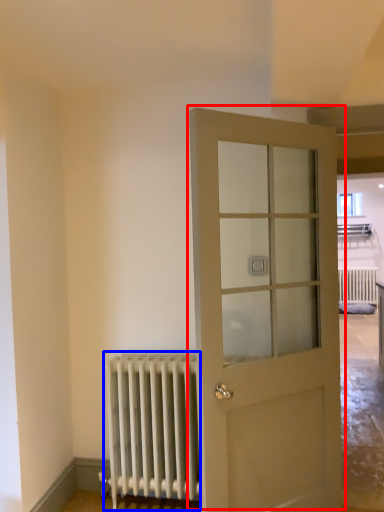
Question: Which object is closer to the camera taking this photo, door (highlighted by a red box) or radiator (highlighted by a blue box)?

Choices:
 (A) door
 (B) radiator

Answer: (A)